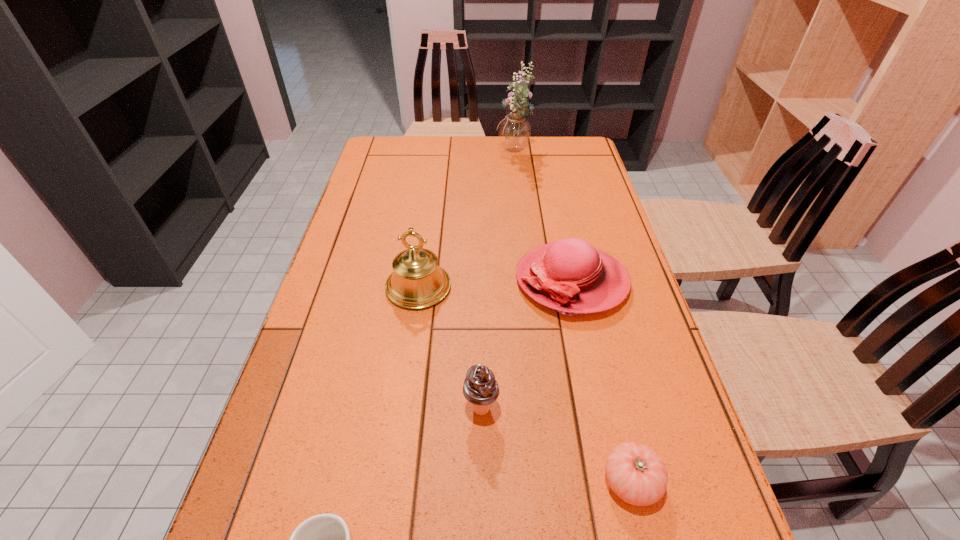
The width and height of the screenshot is (960, 540). I want to click on free region at the far edge of the desktop, so click(x=545, y=157).

Locate an element on the screen. The height and width of the screenshot is (540, 960). vacant space at the left edge is located at coordinates (397, 232).

In the image, there is a desktop. At what (x,y) coordinates should I click in order to perform the action: click on vacant space at the right edge. Please return your answer as a coordinate pair (x, y). Looking at the image, I should click on (589, 230).

The width and height of the screenshot is (960, 540). I want to click on free space at the far left corner of the desktop, so click(385, 150).

Locate an element on the screen. The height and width of the screenshot is (540, 960). free area in between the tallest object and the icecream is located at coordinates (497, 282).

The height and width of the screenshot is (540, 960). In order to click on vacant region between the bouquet and the fifth farthest object in this screenshot , I will do `click(572, 318)`.

Find the location of a particular element. free spot between the hat and the fourth farthest object is located at coordinates (526, 345).

You are a GUI agent. You are given a task and a screenshot of the screen. Output one action in this format:
    pyautogui.click(x=<x>, y=<y>)
    Task: Click on the empty space that is in between the second tallest object and the bouquet
    This screenshot has width=960, height=540.
    Given the screenshot: What is the action you would take?
    pyautogui.click(x=467, y=221)

Where is `object identified as the second closest to the third shortest object`? The image size is (960, 540). object identified as the second closest to the third shortest object is located at coordinates (480, 388).

Where is `the third closest object to the hat`? The width and height of the screenshot is (960, 540). the third closest object to the hat is located at coordinates (635, 472).